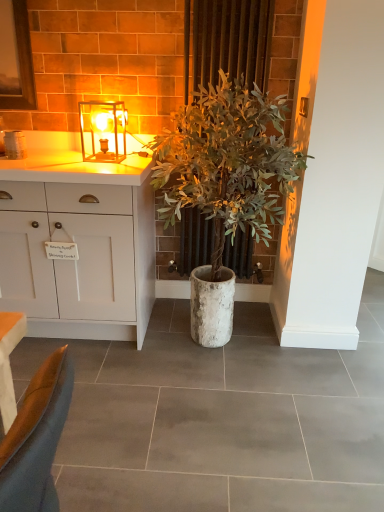
What do you see at coordinates (103, 131) in the screenshot?
I see `matte glass lamp at upper center` at bounding box center [103, 131].

What is the approximate width of white matte cabinet at left?

white matte cabinet at left is 63.69 centimeters in width.

What do you see at coordinates (227, 162) in the screenshot?
I see `green leafy plant at center` at bounding box center [227, 162].

The width and height of the screenshot is (384, 512). I want to click on matte glass lamp at upper center, so click(103, 131).

From a real-world perspective, is matte glass lamp at upper center positioned over green leafy plant at center based on gravity?

Yes, from a real-world perspective, matte glass lamp at upper center is on top of green leafy plant at center.

Where is `curtain in front of the matte glass lamp at upper center`? curtain in front of the matte glass lamp at upper center is located at coordinates (232, 41).

Between matte glass lamp at upper center and green leafy plant at center, which one has smaller width?

green leafy plant at center is thinner.

Who is bigger, matte glass lamp at upper center or green leafy plant at center?

Bigger between the two is green leafy plant at center.

Looking at their sizes, would you say green leafy plant at center is wider or thinner than white matte cabinet at left?

green leafy plant at center is thinner than white matte cabinet at left.

Between green leafy plant at center and white matte cabinet at left, which one has larger size?

green leafy plant at center.

Is green leafy plant at center with white matte cabinet at left?

No.

Is green leafy plant at center at the right side of white matte cabinet at left?

Indeed, green leafy plant at center is positioned on the right side of white matte cabinet at left.

Which object is closer to the camera taking this photo, green leafy plant at center or green leafy plant at center?

green leafy plant at center is in front.

Considering the sizes of objects green leafy plant at center and green leafy plant at center in the image provided, who is taller, green leafy plant at center or green leafy plant at center?

Standing taller between the two is green leafy plant at center.

Can you confirm if green leafy plant at center is smaller than green leafy plant at center?

Correct, green leafy plant at center occupies less space than green leafy plant at center.

In the scene shown: From a real-world perspective, is green leafy plant at center above or below green leafy plant at center?

In terms of real-world spatial position, green leafy plant at center is above green leafy plant at center.

Is green leafy plant at center positioned before green leafy plant at center?

Yes, green leafy plant at center is closer to the viewer.

Between green leafy plant at center and green leafy plant at center, which one has smaller width?

green leafy plant at center.

From a real-world perspective, which object stands above the other?

green leafy plant at center is physically above.

Can you confirm if white matte cabinet at left is bigger than matte glass lamp at upper center?

Yes.

Which is in front, white matte cabinet at left or matte glass lamp at upper center?

white matte cabinet at left.

Identify the location of lamp above the white matte cabinet at left (from a real-world perspective). (103, 131).

Is matte glass lamp at upper center wider or thinner than white matte cabinet at left?

In the image, matte glass lamp at upper center appears to be more narrow than white matte cabinet at left.

Does point (125, 137) lie in front of point (33, 275)?

No.

From a real-world perspective, who is located higher, matte glass lamp at upper center or white matte cabinet at left?

From a 3D spatial view, matte glass lamp at upper center is above.

Identify the location of cabinetry below the green leafy plant at center (from the image's perspective). This screenshot has width=384, height=512. (72, 261).

Is point (83, 203) closer to camera compared to point (185, 234)?

Yes.

Considering the sizes of objects white matte cabinet at left and green leafy plant at center in the image provided, who is smaller, white matte cabinet at left or green leafy plant at center?

Smaller between the two is green leafy plant at center.

From the image's perspective, is white matte cabinet at left under green leafy plant at center?

Correct, white matte cabinet at left appears lower than green leafy plant at center in the image.

This screenshot has height=512, width=384. What are the coordinates of `lamp behind the green leafy plant at center` in the screenshot? It's located at (103, 131).

Locate an element on the screen. The height and width of the screenshot is (512, 384). houseplant that appears on the right of white matte cabinet at left is located at coordinates (227, 162).

Estimate the real-world distances between objects in this image. Which object is closer to white matte cabinet at left, green leafy plant at center or green leafy plant at center?

green leafy plant at center lies closer to white matte cabinet at left than the other object.

Estimate the real-world distances between objects in this image. Which object is further from white matte cabinet at left, green leafy plant at center or matte glass lamp at upper center?

green leafy plant at center is positioned further to the anchor white matte cabinet at left.

Looking at this image, based on their spatial positions, is matte glass lamp at upper center or white matte cabinet at left further from green leafy plant at center?

matte glass lamp at upper center.

When comparing their distances from white matte cabinet at left, does green leafy plant at center or matte glass lamp at upper center seem further?

matte glass lamp at upper center is further to white matte cabinet at left.

Based on their spatial positions, is green leafy plant at center or white matte cabinet at left closer to matte glass lamp at upper center?

white matte cabinet at left lies closer to matte glass lamp at upper center than the other object.

When comparing their distances from matte glass lamp at upper center, does green leafy plant at center or white matte cabinet at left seem further?

green leafy plant at center is positioned further to the anchor matte glass lamp at upper center.

Estimate the real-world distances between objects in this image. Which object is closer to matte glass lamp at upper center, white matte cabinet at left or green leafy plant at center?

white matte cabinet at left lies closer to matte glass lamp at upper center than the other object.

Looking at the image, which one is located further to green leafy plant at center, green leafy plant at center or white matte cabinet at left?

Among the two, white matte cabinet at left is located further to green leafy plant at center.

This screenshot has width=384, height=512. I want to click on houseplant situated between matte glass lamp at upper center and green leafy plant at center from left to right, so pos(227,162).

Locate an element on the screen. lamp between white matte cabinet at left and green leafy plant at center is located at coordinates (103, 131).

You are a GUI agent. You are given a task and a screenshot of the screen. Output one action in this format:
    pyautogui.click(x=<x>, y=<y>)
    Task: Click on the lamp between white matte cabinet at left and green leafy plant at center in the horizontal direction
    The height and width of the screenshot is (512, 384).
    Given the screenshot: What is the action you would take?
    pyautogui.click(x=103, y=131)

Identify the location of houseplant between white matte cabinet at left and green leafy plant at center from left to right. This screenshot has height=512, width=384. (227, 162).